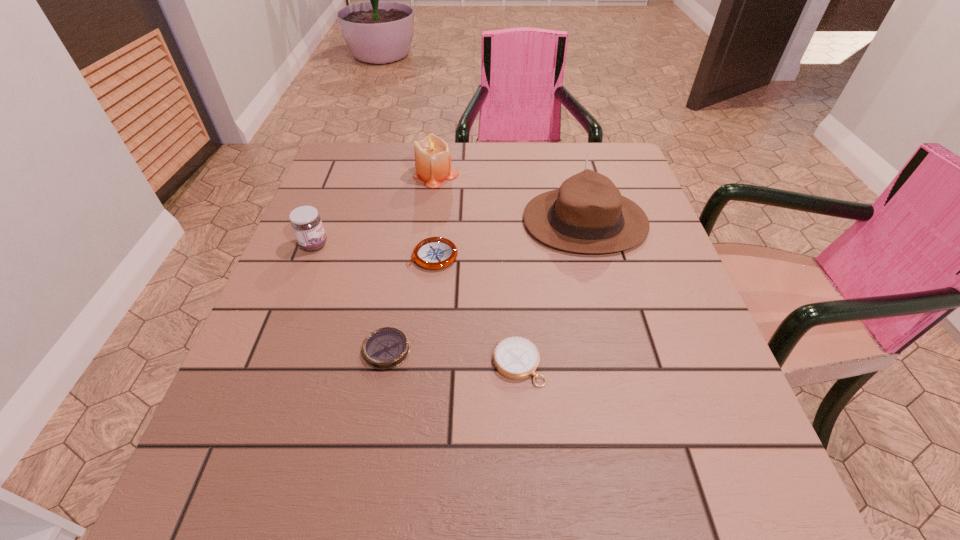
Identify the location of vacant space at the near edge of the desktop. (450, 465).

Find the location of a particular element. This screenshot has width=960, height=540. free location at the left edge is located at coordinates (268, 406).

Find the location of a particular element. The image size is (960, 540). vacant area at the right edge of the desktop is located at coordinates (638, 367).

Find the location of a particular element. Image resolution: width=960 pixels, height=540 pixels. vacant region at the far left corner of the desktop is located at coordinates (384, 153).

Locate an element on the screen. The height and width of the screenshot is (540, 960). vacant space at the near left corner of the desktop is located at coordinates (292, 488).

Where is `free space at the far right corner`? Image resolution: width=960 pixels, height=540 pixels. free space at the far right corner is located at coordinates (613, 176).

Where is `vacant space at the near right corner`? This screenshot has height=540, width=960. vacant space at the near right corner is located at coordinates (722, 494).

This screenshot has width=960, height=540. In order to click on free space between the fedora and the farthest object in this screenshot , I will do `click(511, 198)`.

Image resolution: width=960 pixels, height=540 pixels. Identify the location of vacant area between the fedora and the tallest compass. pyautogui.click(x=509, y=239).

Where is `vacant point located between the jam and the rightmost compass`? vacant point located between the jam and the rightmost compass is located at coordinates (417, 304).